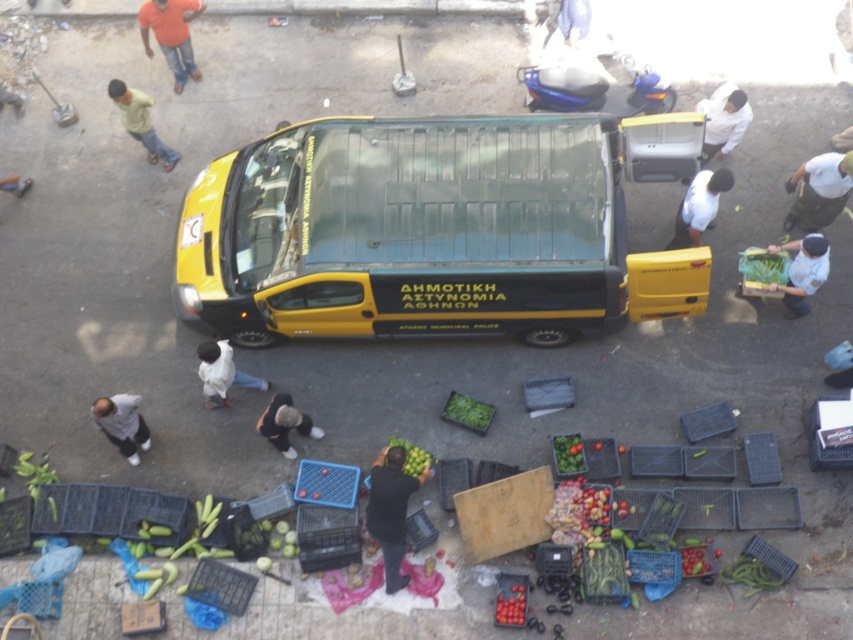
Question: Is white matte shirt at upper right to the right of light gray sweater at lower left from the viewer's perspective?

Choices:
 (A) yes
 (B) no

Answer: (A)

Question: Is dark blue jeans at center wider than white matte shirt at upper right?

Choices:
 (A) yes
 (B) no

Answer: (B)

Question: Which of the following is the farthest from the observer?

Choices:
 (A) white uniform at center
 (B) green leafy vegetables at center

Answer: (B)

Question: Considering the real-world distances, which object is closest to the dark blue jeans at center?

Choices:
 (A) green matte cucumber at lower left
 (B) smooth white shirt at upper left
 (C) yellow matte bus at center
 (D) white matte shirt at center

Answer: (C)

Question: Which point is closer to the camera?

Choices:
 (A) yellow matte bus at center
 (B) light green cotton shirt at left
 (C) dark blue jeans at center

Answer: (C)

Question: Is white uniform at center in front of white matte shirt at upper right?

Choices:
 (A) yes
 (B) no

Answer: (A)